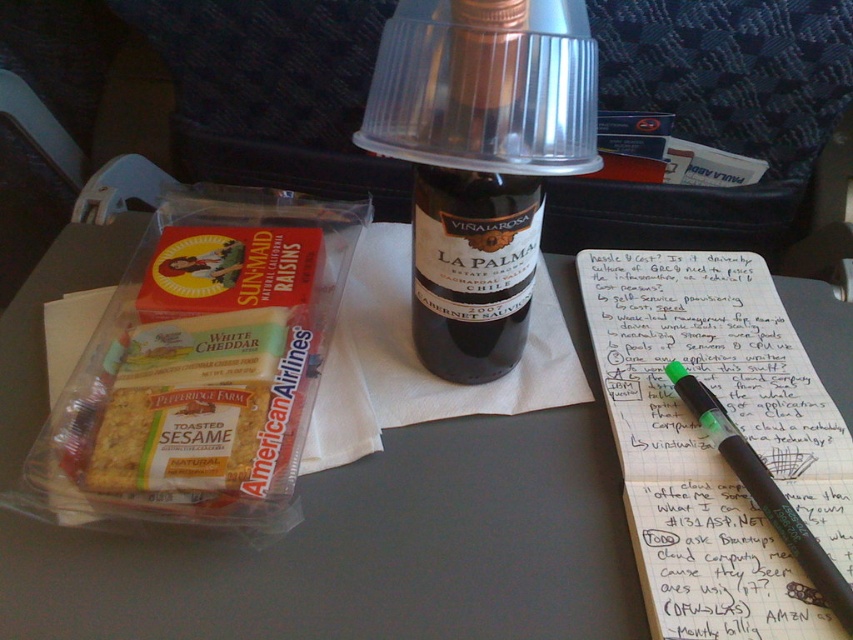
You are a flight attendant checking the table settings. You need to hand a passenger the green pen at upper right and the green matte pen at upper right. Which one is easier to reach without moving your hand much?

The green pen at upper right is closer to the viewer than the green matte pen at upper right, so it is easier to reach without moving your hand much.

You are a flight attendant on an airplane. You need to place a new menu on the table, which is wider than the matte plastic tray at center. Where should you place the menu so it doesn not block the green matte pen at upper right?

Place the menu to the left of the matte plastic tray at center since the green matte pen at upper right is already to the right of the tray and the menu is wider, placing it to the left would avoid blocking the pen.

You are seated at the airplane table and need to reach for the dark glass bottle at center. Considering the packaged snack from American Airlines on the left and the small bag of Sun_Maid raisins next to it, where should you reach to grab the bottle?

The dark glass bottle at center is located at point (473, 269), so you should reach towards the central area of the table between the packaged snack on the left and the raisins next to it.